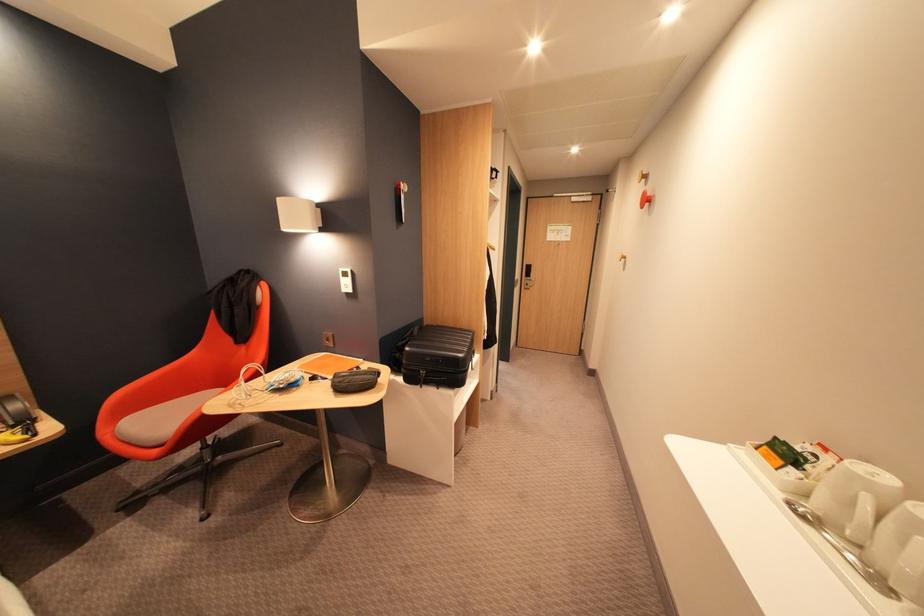
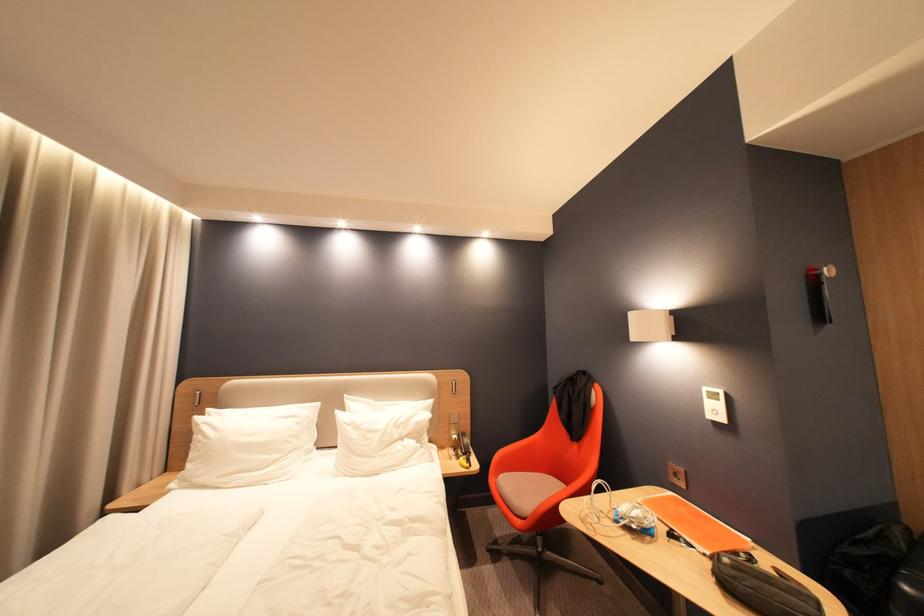
Locate, in the second image, the point that corresponds to [357,286] in the first image.

(724, 413)